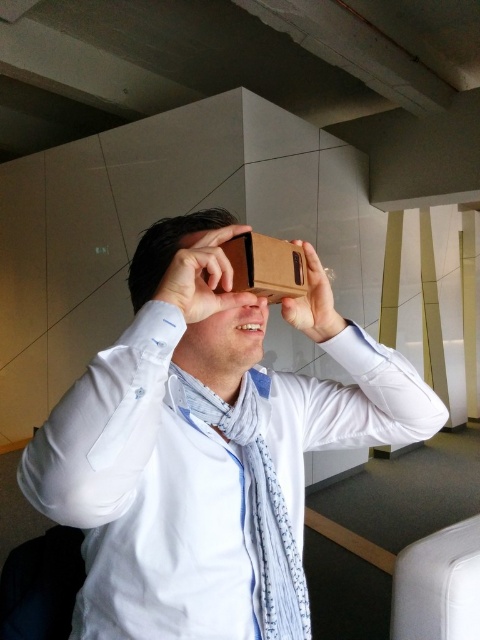
You are a photographer trying to capture the light blue textured scarf at center and the brown cardboard at upper center in a single shot. Which object will appear larger in the photo?

The light blue textured scarf at center will appear larger in the photo because it is closer to the viewer than the brown cardboard at upper center.